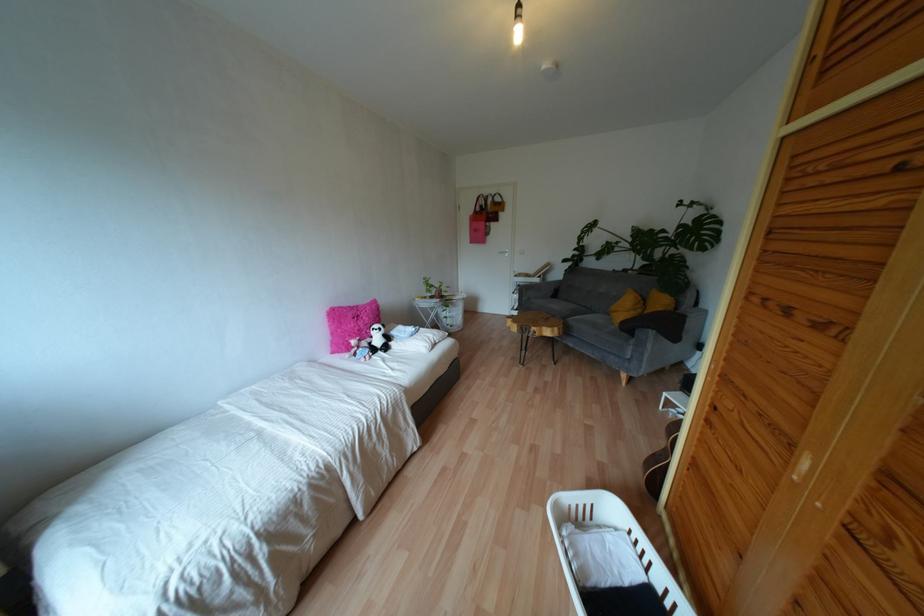
What do you see at coordinates (350, 323) in the screenshot?
I see `the pink furry pillow` at bounding box center [350, 323].